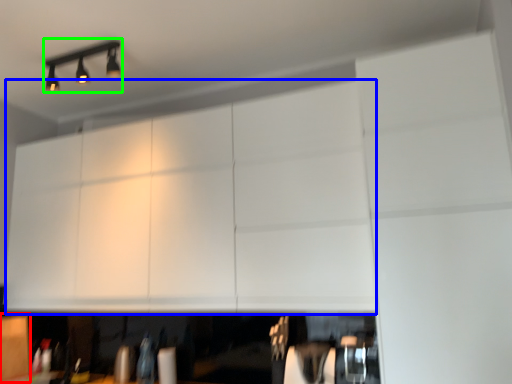
Question: Which object is the farthest from cabinetry (highlighted by a red box)? Choose among these: cabinetry (highlighted by a blue box) or lamp (highlighted by a green box).

Choices:
 (A) cabinetry
 (B) lamp

Answer: (B)